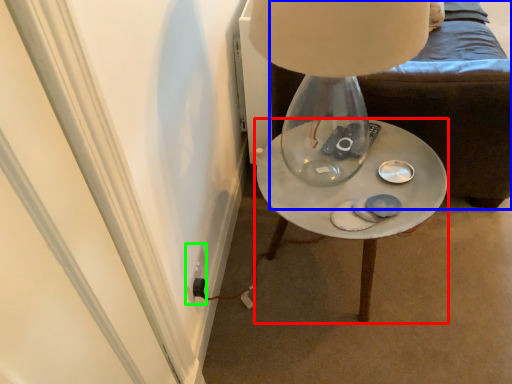
Question: Estimate the real-world distances between objects in this image. Which object is farther from table (highlighted by a red box), furniture (highlighted by a blue box) or electric outlet (highlighted by a green box)?

Choices:
 (A) furniture
 (B) electric outlet

Answer: (B)